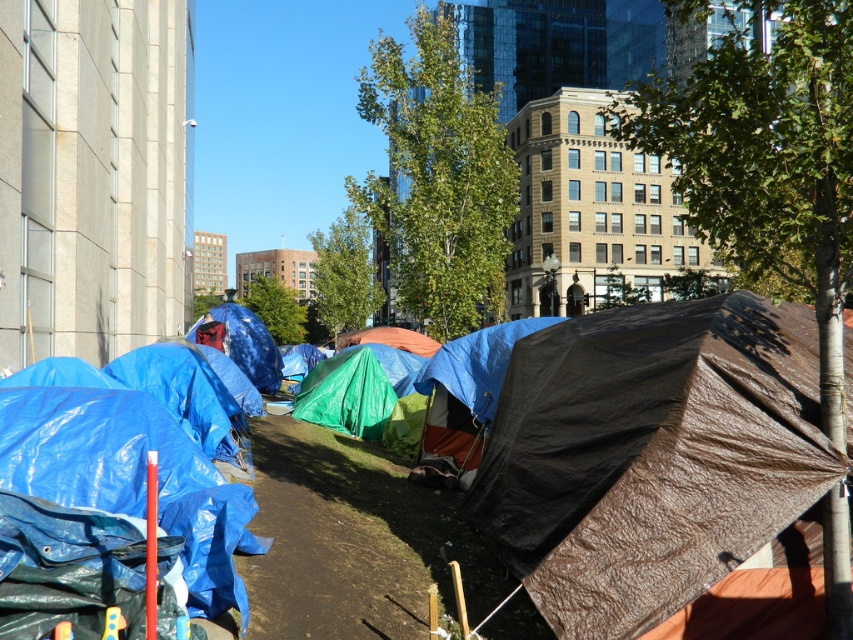
Which is below, brown tarp at center or blue tarp at center?

blue tarp at center

Image resolution: width=853 pixels, height=640 pixels. What do you see at coordinates (650, 456) in the screenshot?
I see `brown tarp at center` at bounding box center [650, 456].

Image resolution: width=853 pixels, height=640 pixels. I want to click on brown tarp at center, so click(650, 456).